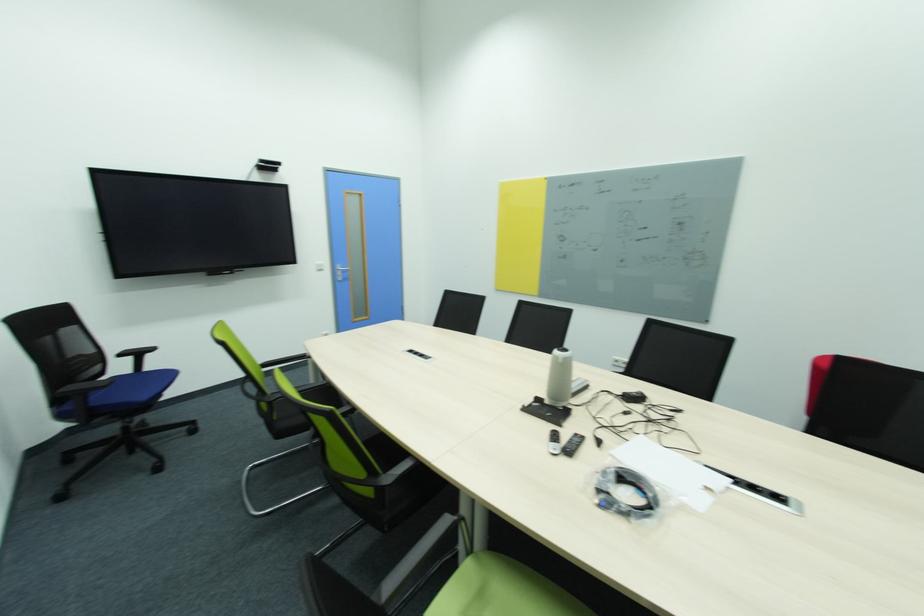
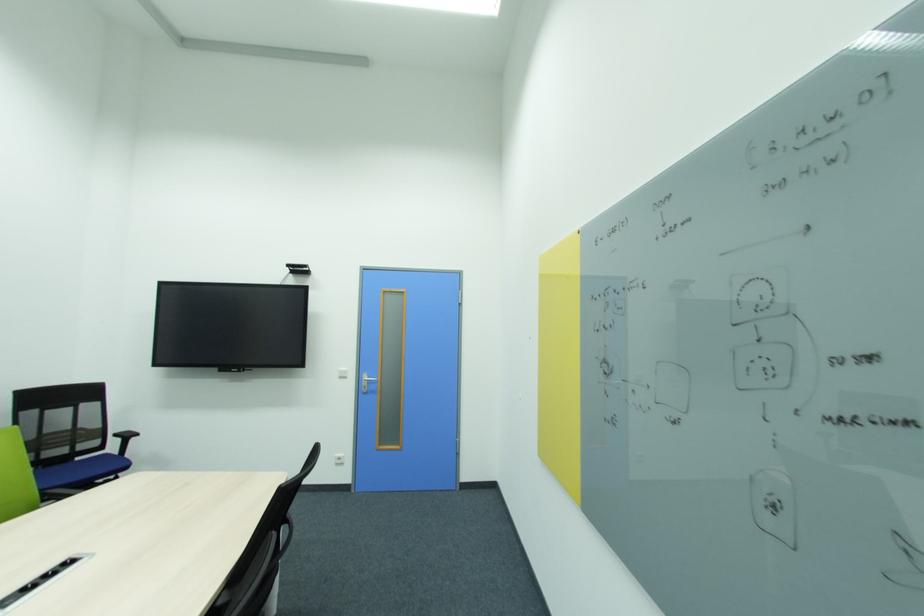
Find the pixel in the second image that matches [565,237] in the first image.

(610, 362)